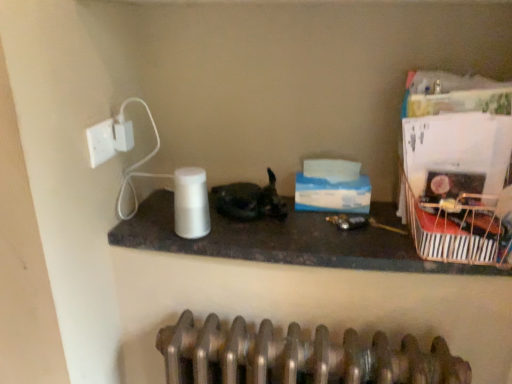
Identify the location of blank area beneath shiny black cat at center (from a real-world perspective). This screenshot has width=512, height=384. (260, 214).